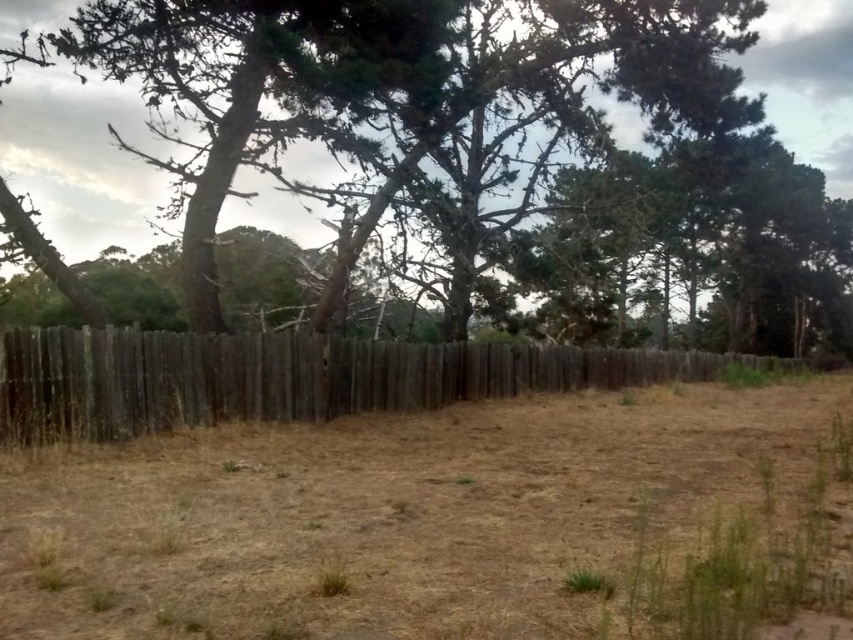
Question: Can you confirm if brown dry soil at center is positioned to the right of green textured tree at center?

Choices:
 (A) yes
 (B) no

Answer: (B)

Question: Is brown dry soil at center below green textured tree at center?

Choices:
 (A) yes
 (B) no

Answer: (A)

Question: Which object is positioned closest to the green textured tree at center?

Choices:
 (A) weathered wood fence at center
 (B) brown dry soil at center

Answer: (A)

Question: Does brown dry soil at center have a smaller size compared to green textured tree at center?

Choices:
 (A) yes
 (B) no

Answer: (A)

Question: Which of the following is the closest to the observer?

Choices:
 (A) (802, 147)
 (B) (386, 362)

Answer: (B)

Question: Which object is the closest to the weathered wood fence at center?

Choices:
 (A) green textured tree at center
 (B) brown dry soil at center

Answer: (B)